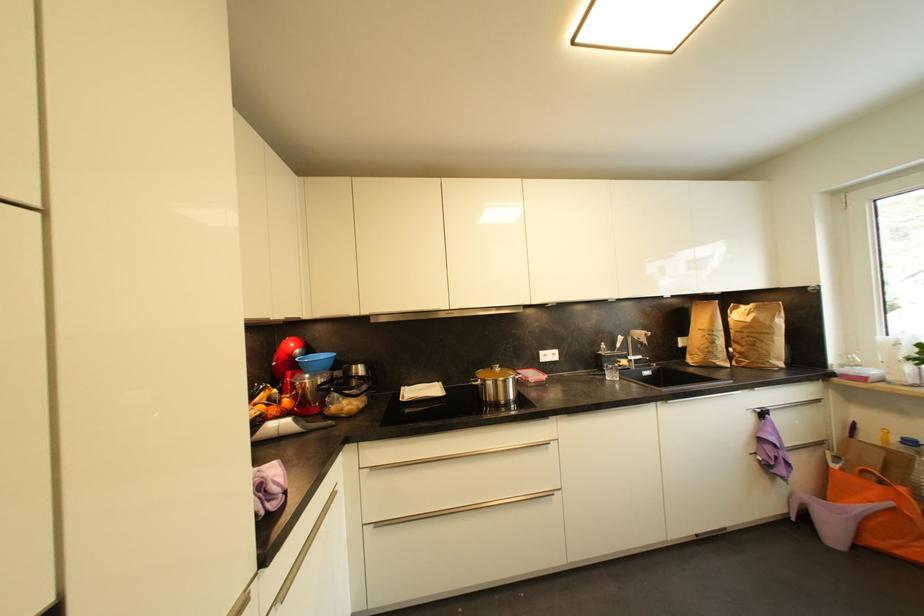
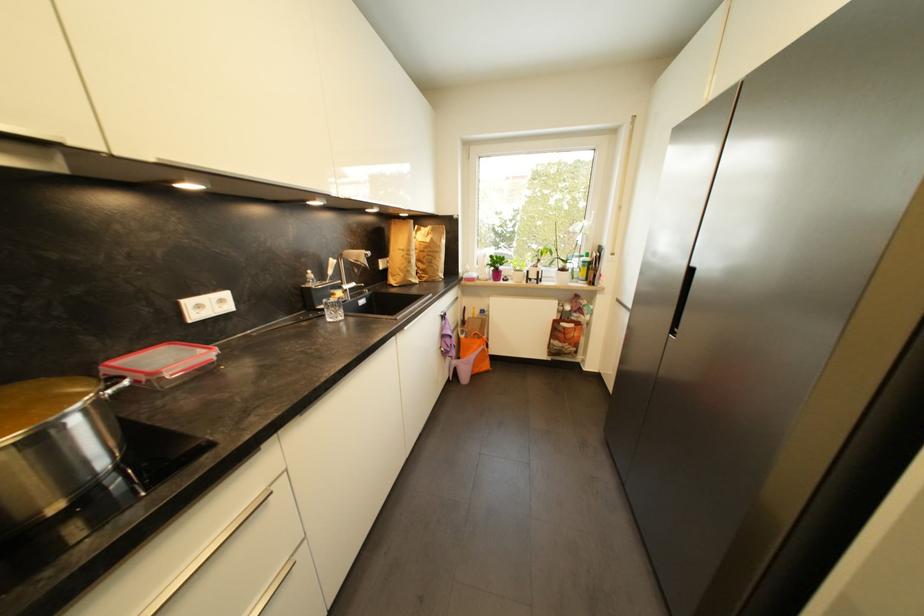
The point at (840, 468) is marked in the first image. Where is the corresponding point in the second image?

(468, 339)